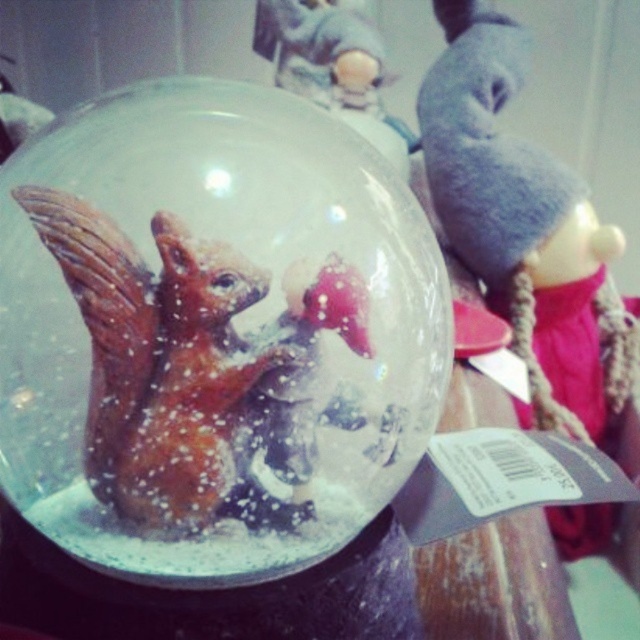
Question: Which point appears farthest from the camera in this image?

Choices:
 (A) (264, 472)
 (B) (244, 285)

Answer: (A)

Question: Can you confirm if transparent glass globe at center is positioned to the left of shiny brown squirrel at center?

Choices:
 (A) yes
 (B) no

Answer: (B)

Question: Which of the following is the closest to the observer?

Choices:
 (A) shiny brown squirrel at center
 (B) transparent glass globe at center

Answer: (B)

Question: Is transparent glass globe at center further to the viewer compared to shiny brown squirrel at center?

Choices:
 (A) yes
 (B) no

Answer: (B)

Question: Can you confirm if transparent glass globe at center is positioned to the right of shiny brown squirrel at center?

Choices:
 (A) yes
 (B) no

Answer: (A)